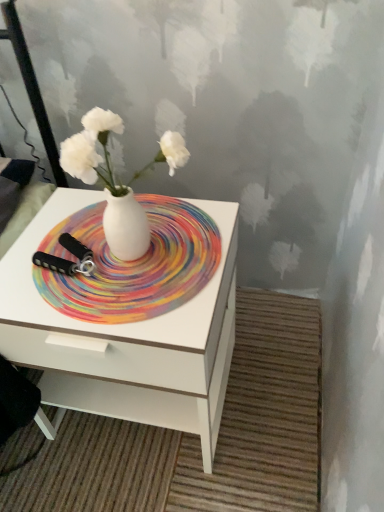
Question: Should I look upward or downward to see white glossy nightstand at center?

Choices:
 (A) down
 (B) up

Answer: (A)

Question: Is rainbow swirl placemat at center smaller than white glossy nightstand at center?

Choices:
 (A) no
 (B) yes

Answer: (B)

Question: Considering the relative sizes of rainbow swirl placemat at center and white glossy nightstand at center in the image provided, is rainbow swirl placemat at center wider than white glossy nightstand at center?

Choices:
 (A) yes
 (B) no

Answer: (B)

Question: Does rainbow swirl placemat at center contain white glossy nightstand at center?

Choices:
 (A) yes
 (B) no

Answer: (B)

Question: Can you confirm if rainbow swirl placemat at center is taller than white glossy nightstand at center?

Choices:
 (A) no
 (B) yes

Answer: (A)

Question: From a real-world perspective, is rainbow swirl placemat at center beneath white glossy nightstand at center?

Choices:
 (A) no
 (B) yes

Answer: (A)

Question: Is rainbow swirl placemat at center placed right next to white glossy nightstand at center?

Choices:
 (A) no
 (B) yes

Answer: (A)

Question: Is white glossy nightstand at center directly adjacent to rainbow swirl placemat at center?

Choices:
 (A) yes
 (B) no

Answer: (B)

Question: Is white glossy nightstand at center facing away from rainbow swirl placemat at center?

Choices:
 (A) no
 (B) yes

Answer: (A)

Question: Is rainbow swirl placemat at center a part of white glossy nightstand at center?

Choices:
 (A) no
 (B) yes

Answer: (B)

Question: Considering the relative sizes of white glossy nightstand at center and rainbow swirl placemat at center in the image provided, is white glossy nightstand at center thinner than rainbow swirl placemat at center?

Choices:
 (A) no
 (B) yes

Answer: (A)

Question: Can you confirm if white glossy nightstand at center is shorter than rainbow swirl placemat at center?

Choices:
 (A) yes
 (B) no

Answer: (B)

Question: Does white glossy nightstand at center have a larger size compared to rainbow swirl placemat at center?

Choices:
 (A) no
 (B) yes

Answer: (B)

Question: Does white glossy vase at center have a smaller size compared to rainbow swirl placemat at center?

Choices:
 (A) yes
 (B) no

Answer: (B)